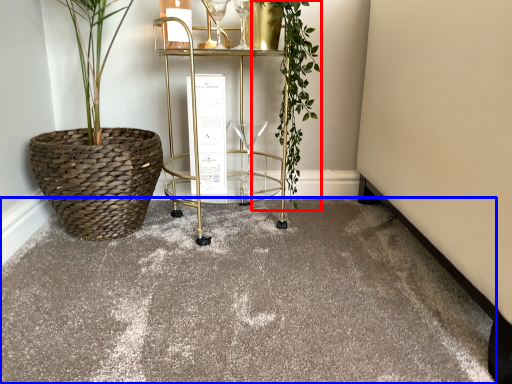
Question: Which point is closer to the camera, vegetation (highlighted by a red box) or concrete (highlighted by a blue box)?

Choices:
 (A) vegetation
 (B) concrete

Answer: (B)